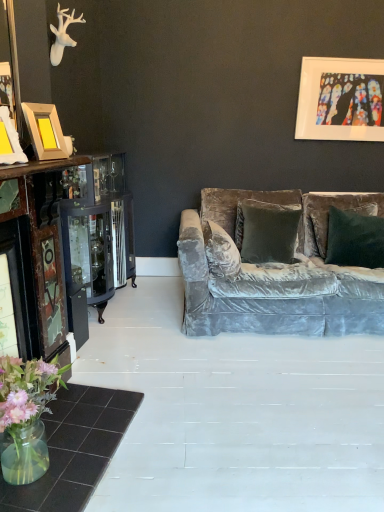
Question: Should I look upward or downward to see stained glass artwork at upper right, the 2th picture frame in the front-to-back sequence?

Choices:
 (A) up
 (B) down

Answer: (A)

Question: Can we say wooden photo frame at left, which is the second picture frame from back to front, lies outside velvet green pillow at center?

Choices:
 (A) no
 (B) yes

Answer: (B)

Question: Is wooden photo frame at left, which ranks as the second picture frame in top-to-bottom order, positioned behind velvet green pillow at center?

Choices:
 (A) no
 (B) yes

Answer: (A)

Question: From a real-world perspective, does wooden photo frame at left, the second picture frame from the right, sit lower than velvet green pillow at center?

Choices:
 (A) yes
 (B) no

Answer: (B)

Question: Considering the relative positions of wooden photo frame at left, which is the second picture frame from back to front, and velvet green pillow at center in the image provided, is wooden photo frame at left, which is the second picture frame from back to front, to the right of velvet green pillow at center from the viewer's perspective?

Choices:
 (A) yes
 (B) no

Answer: (B)

Question: Is velvet green pillow at center inside wooden photo frame at left, the second picture frame from the right?

Choices:
 (A) yes
 (B) no

Answer: (B)

Question: Does wooden photo frame at left, the 1th picture frame in the bottom-to-top sequence, have a lesser width compared to velvet green pillow at center?

Choices:
 (A) yes
 (B) no

Answer: (A)

Question: Would you say velvet green pillow at center is part of stained glass artwork at upper right, the 1th picture frame in the right-to-left sequence,'s contents?

Choices:
 (A) no
 (B) yes

Answer: (A)

Question: Is stained glass artwork at upper right, which ranks as the 2th picture frame in bottom-to-top order, behind velvet green pillow at center?

Choices:
 (A) no
 (B) yes

Answer: (B)

Question: Is stained glass artwork at upper right, positioned as the first picture frame in top-to-bottom order, in contact with velvet green pillow at center?

Choices:
 (A) yes
 (B) no

Answer: (B)

Question: From a real-world perspective, is stained glass artwork at upper right, which is the first picture frame in back-to-front order, located higher than velvet green pillow at center?

Choices:
 (A) no
 (B) yes

Answer: (B)

Question: Is stained glass artwork at upper right, the 2th picture frame in the front-to-back sequence, wider than velvet green pillow at center?

Choices:
 (A) yes
 (B) no

Answer: (B)

Question: Can you confirm if stained glass artwork at upper right, positioned as the first picture frame in top-to-bottom order, is thinner than velvet green pillow at center?

Choices:
 (A) yes
 (B) no

Answer: (A)

Question: From the image's perspective, is translucent glass vase at lower left on top of velvet green pillow at center?

Choices:
 (A) yes
 (B) no

Answer: (B)